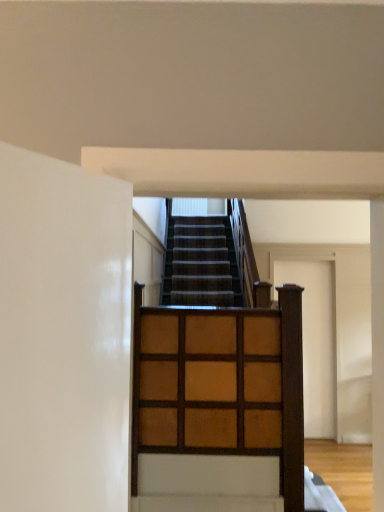
In order to face wooden grid at center, should I rotate leftwards or rightwards?

Turn right approximately 2.494 degrees to face it.

Image resolution: width=384 pixels, height=512 pixels. In order to click on wooden grid at center in this screenshot , I will do `click(221, 385)`.

Describe the element at coordinates (221, 385) in the screenshot. I see `wooden grid at center` at that location.

At what (x,y) coordinates should I click in order to perform the action: click on wooden door at center. Please return your answer as a coordinate pair (x, y). Looking at the image, I should click on (314, 339).

Measure the distance between point (306, 370) and camera.

They are 4.78 meters apart.

What do you see at coordinates (314, 339) in the screenshot? The height and width of the screenshot is (512, 384). I see `wooden door at center` at bounding box center [314, 339].

At what (x,y) coordinates should I click in order to perform the action: click on wooden grid at center. Please return your answer as a coordinate pair (x, y). This screenshot has height=512, width=384. Looking at the image, I should click on (221, 385).

Is wooden grid at center at the left side of wooden door at center?

Correct, you'll find wooden grid at center to the left of wooden door at center.

Considering the positions of objects wooden grid at center and wooden door at center in the image provided, who is behind, wooden grid at center or wooden door at center?

wooden door at center is behind.

Considering the positions of point (152, 329) and point (331, 388), is point (152, 329) closer or farther from the camera than point (331, 388)?

Point (152, 329) is closer to the camera than point (331, 388).

From the image's perspective, is wooden grid at center on top of wooden door at center?

Yes.

From a real-world perspective, relative to wooden door at center, is wooden grid at center vertically above or below?

Clearly, from a real-world perspective, wooden grid at center is above wooden door at center.

Can you confirm if wooden grid at center is wider than wooden door at center?

Yes.

Between wooden grid at center and wooden door at center, which one has more height?

With more height is wooden door at center.

Considering the sizes of objects wooden grid at center and wooden door at center in the image provided, who is smaller, wooden grid at center or wooden door at center?

wooden grid at center.

Choose the correct answer: Is wooden grid at center inside wooden door at center or outside it?

wooden grid at center lies outside wooden door at center.

Is wooden grid at center next to wooden door at center?

No, wooden grid at center is not beside wooden door at center.

Is wooden grid at center turned away from wooden door at center?

Yes, wooden grid at center's orientation is away from wooden door at center.

How many degrees apart are the facing directions of wooden grid at center and wooden door at center?

1.53 degrees separate the facing orientations of wooden grid at center and wooden door at center.

How far apart are wooden grid at center and wooden door at center?

wooden grid at center and wooden door at center are 2.41 meters apart.

At what (x,y) coordinates should I click in order to perform the action: click on dresser above the wooden door at center (from a real-world perspective). Please return your answer as a coordinate pair (x, y). The width and height of the screenshot is (384, 512). Looking at the image, I should click on (221, 385).

Is wooden door at center to the left of wooden grid at center from the viewer's perspective?

No, wooden door at center is not to the left of wooden grid at center.

Which is behind, wooden door at center or wooden grid at center?

Positioned behind is wooden door at center.

Which is closer, (321, 384) or (267, 373)?

Point (321, 384) appears to be farther away from the viewer than point (267, 373).

From the image's perspective, is wooden door at center under wooden grid at center?

Indeed, from the image's perspective, wooden door at center is shown beneath wooden grid at center.

From a real-world perspective, between wooden door at center and wooden grid at center, who is vertically lower?

wooden door at center.

Looking at their sizes, would you say wooden door at center is wider or thinner than wooden grid at center?

In the image, wooden door at center appears to be more narrow than wooden grid at center.

Considering the relative sizes of wooden door at center and wooden grid at center in the image provided, is wooden door at center shorter than wooden grid at center?

No.

Who is bigger, wooden door at center or wooden grid at center?

wooden door at center.

Is wooden grid at center located within wooden door at center?

No, wooden grid at center is located outside of wooden door at center.

Would you consider wooden door at center to be distant from wooden grid at center?

wooden door at center is positioned a significant distance from wooden grid at center.

Based on the photo, is wooden door at center turned away from wooden grid at center?

wooden door at center is not turned away from wooden grid at center.

Find the location of `door lying behind the wooden grid at center`. door lying behind the wooden grid at center is located at coordinates (314, 339).

Where is `door that is on the right side of wooden grid at center`? The image size is (384, 512). door that is on the right side of wooden grid at center is located at coordinates (314, 339).

In order to click on dresser that is above the wooden door at center (from a real-world perspective) in this screenshot , I will do `click(221, 385)`.